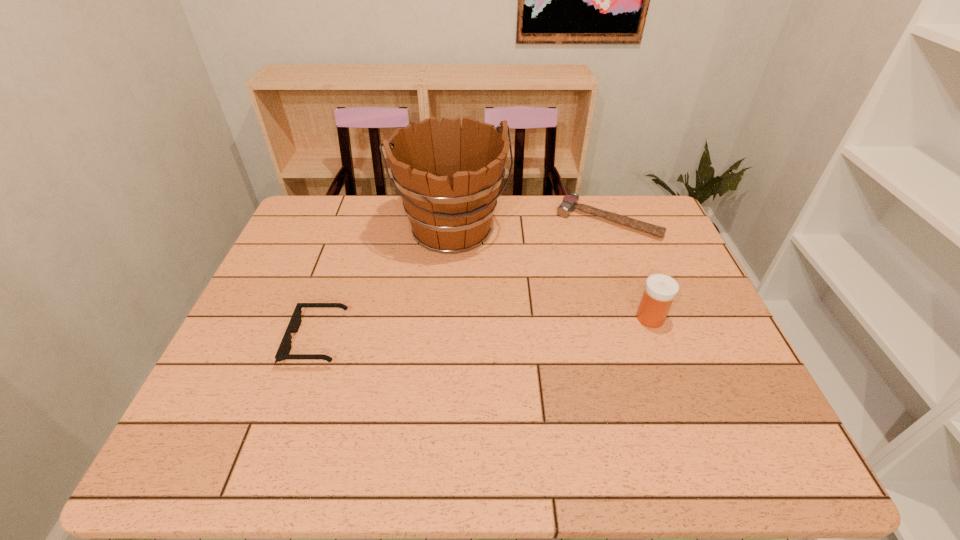
The height and width of the screenshot is (540, 960). In order to click on the leftmost object in this screenshot , I will do `click(283, 351)`.

Where is `medicine`? The height and width of the screenshot is (540, 960). medicine is located at coordinates (660, 289).

Where is `wine bucket`? The width and height of the screenshot is (960, 540). wine bucket is located at coordinates (448, 177).

What are the coordinates of `the tallest object` in the screenshot? It's located at (448, 177).

Image resolution: width=960 pixels, height=540 pixels. Find the location of `hammer`. hammer is located at coordinates (569, 203).

The image size is (960, 540). I want to click on vacant area situated on the front-facing side of the leftmost object, so click(238, 340).

Find the location of a particular element. free space located 0.140m on the front-facing side of the leftmost object is located at coordinates (234, 340).

Identify the location of free space located 0.130m on the front-facing side of the leftmost object. This screenshot has height=540, width=960. (238, 340).

At what (x,y) coordinates should I click in order to perform the action: click on free location located on the left of the medicine. Please return your answer as a coordinate pair (x, y). Image resolution: width=960 pixels, height=540 pixels. Looking at the image, I should click on (510, 318).

The width and height of the screenshot is (960, 540). In order to click on vacant space located with the handle on the second object from left to right in this screenshot , I will do pyautogui.click(x=492, y=313).